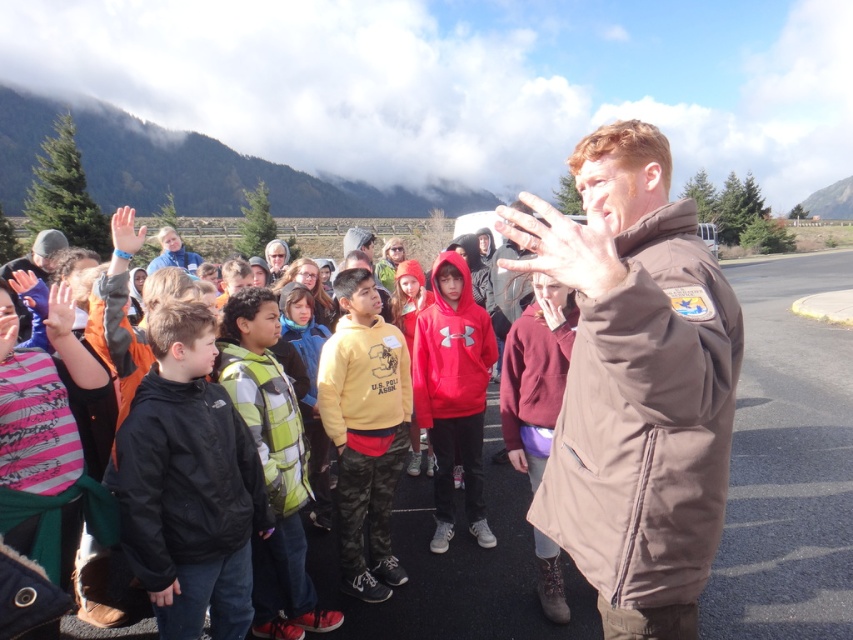
Can you confirm if brown leather hand at center is wider than matte black hand at lower left?

No, brown leather hand at center is not wider than matte black hand at lower left.

Is point (607, 276) in front of point (28, 280)?

Yes, it is in front of point (28, 280).

This screenshot has width=853, height=640. What do you see at coordinates (563, 244) in the screenshot?
I see `brown leather hand at center` at bounding box center [563, 244].

At what (x,y) coordinates should I click in order to perform the action: click on brown leather hand at center. Please return your answer as a coordinate pair (x, y). Looking at the image, I should click on (563, 244).

Can you confirm if maroon fleece at center is bigger than matte brown glove at center?

Correct, maroon fleece at center is larger in size than matte brown glove at center.

Is maroon fleece at center to the right of matte brown glove at center from the viewer's perspective?

Yes, maroon fleece at center is to the right of matte brown glove at center.

Does point (535, 426) come behind point (521, 464)?

No, it is not.

Where is `maroon fleece at center`? This screenshot has height=640, width=853. maroon fleece at center is located at coordinates (537, 371).

Between brown soft jacket at center and yellow fleece at center, which one is positioned higher?

brown soft jacket at center

Does point (583, 484) come in front of point (378, 440)?

Yes, point (583, 484) is closer to viewer.

At what (x,y) coordinates should I click in order to perform the action: click on brown soft jacket at center. Please return your answer as a coordinate pair (x, y). This screenshot has height=640, width=853. Looking at the image, I should click on (636, 385).